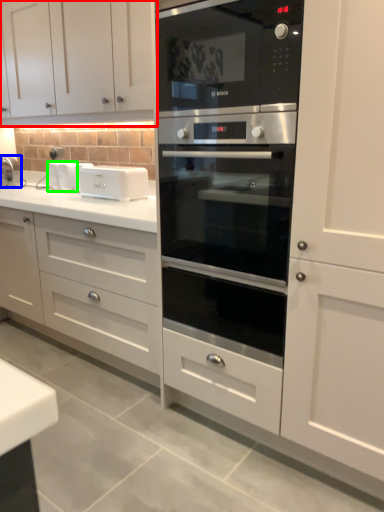
Question: Estimate the real-world distances between objects in this image. Which object is farther from cabinetry (highlighted by a red box), faucet (highlighted by a blue box) or appliance (highlighted by a green box)?

Choices:
 (A) faucet
 (B) appliance

Answer: (A)